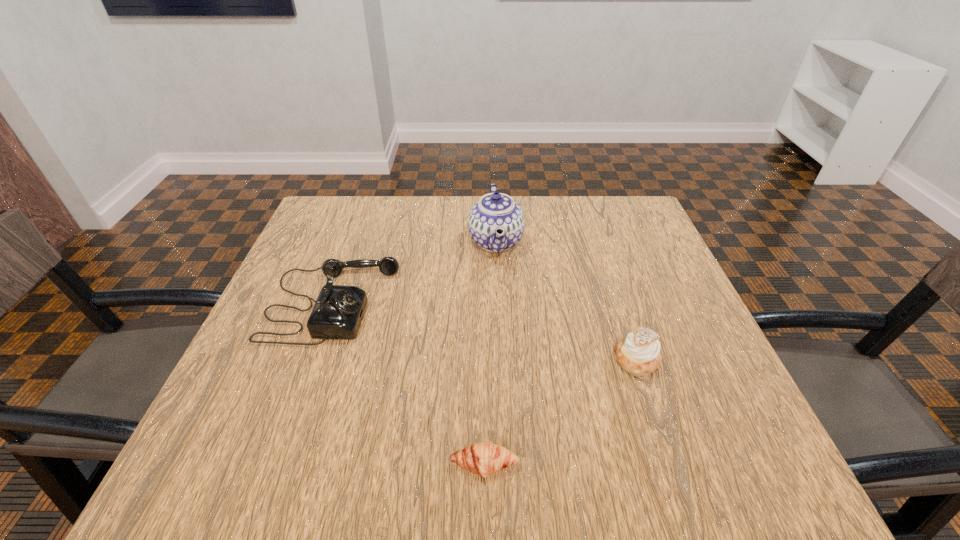
The width and height of the screenshot is (960, 540). In order to click on free region at the far left corner of the desktop in this screenshot , I will do `click(364, 220)`.

In order to click on vacant space at the near left corner of the desktop in this screenshot , I will do `click(263, 477)`.

The width and height of the screenshot is (960, 540). What are the coordinates of `free space at the near right corner` in the screenshot? It's located at (707, 464).

Where is `free space between the tallest object and the shortest object`? The height and width of the screenshot is (540, 960). free space between the tallest object and the shortest object is located at coordinates (490, 353).

Locate an element on the screen. blank region between the left pastry and the rightmost object is located at coordinates (561, 412).

Locate an element on the screen. The height and width of the screenshot is (540, 960). free spot between the tallest object and the telephone is located at coordinates (414, 273).

Where is `free spot between the shorter pastry and the chinaware`? free spot between the shorter pastry and the chinaware is located at coordinates (490, 353).

In order to click on vacant space that is in between the second shortest object and the tallest object in this screenshot , I will do `click(566, 300)`.

Locate an element on the screen. vacant area that lies between the farther pastry and the left pastry is located at coordinates (561, 412).

At what (x,y) coordinates should I click in order to perform the action: click on empty space between the telephone and the shortest object. Please return your answer as a coordinate pair (x, y). Looking at the image, I should click on (408, 384).